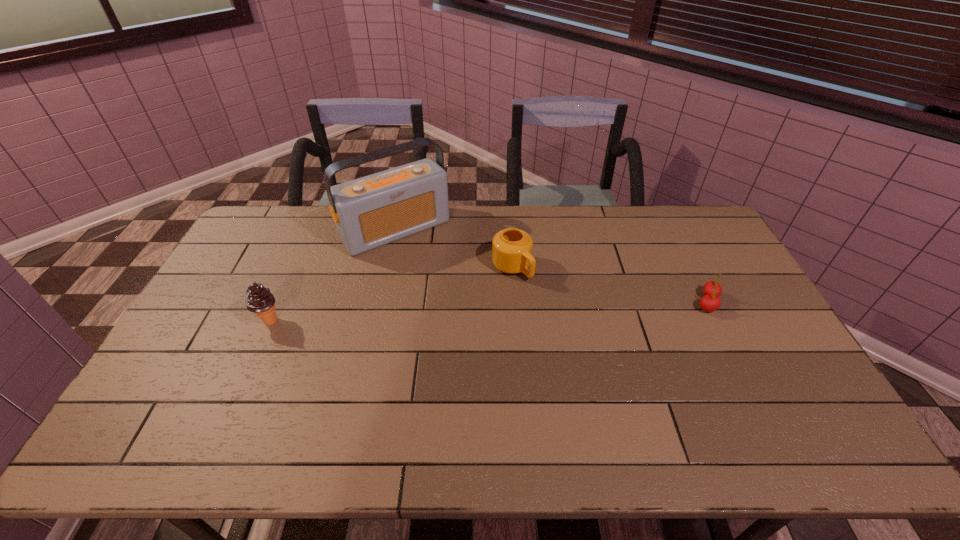
You are a GUI agent. You are given a task and a screenshot of the screen. Output one action in this format:
    pyautogui.click(x=<x>, y=<y>)
    Task: Click on the vacant spot on the desktop that is between the leftmost object and the rightmost object and is positioned on the handle side of the third object from left to right
    The width and height of the screenshot is (960, 540).
    Given the screenshot: What is the action you would take?
    pyautogui.click(x=557, y=309)

I want to click on vacant space on the desktop that is between the leftmost object and the cherry and is positioned on the front-facing side of the third object from right to left, so pos(462,313).